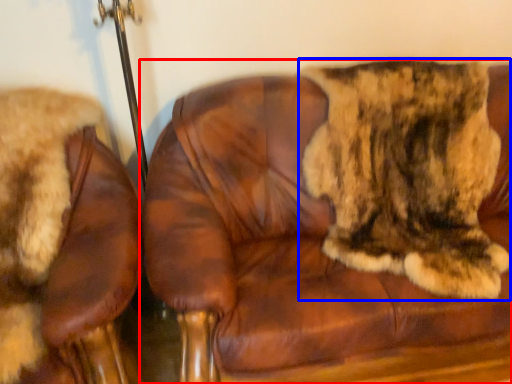
Question: Among these objects, which one is nearest to the camera, chair (highlighted by a red box) or cat (highlighted by a blue box)?

Choices:
 (A) chair
 (B) cat

Answer: (A)